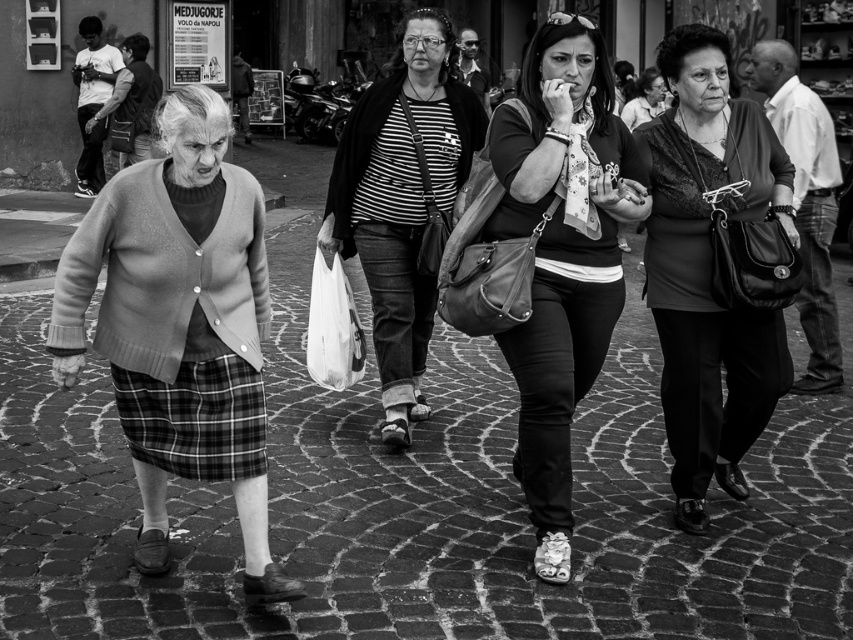
You are a fashion designer observing the women in the street scene. You need to determine which item of clothing has a larger size between the knitted sweater at left and the plaid fabric skirt at lower left. Which one is bigger?

The knitted sweater at left has a larger size compared to the plaid fabric skirt at lower left, so the knitted sweater at left is bigger.

Consider the image. You are standing on the cobblestone pavement and want to place a small flowerpot between the two points marked as point (x=149, y=368) and point (x=221, y=480). Which point should the flowerpot be closer to in order to be nearer to the viewer?

The flowerpot should be closer to point (x=149, y=368) because it is closer to the viewer than point (x=221, y=480).

You are a pedestrian walking on the cobblestone pavement at center. There is a plaid fabric skirt at lower left. Which object is directly beneath your feet?

The cobblestone pavement at center is positioned under the plaid fabric skirt at lower left, so the cobblestone pavement at center is directly beneath your feet.